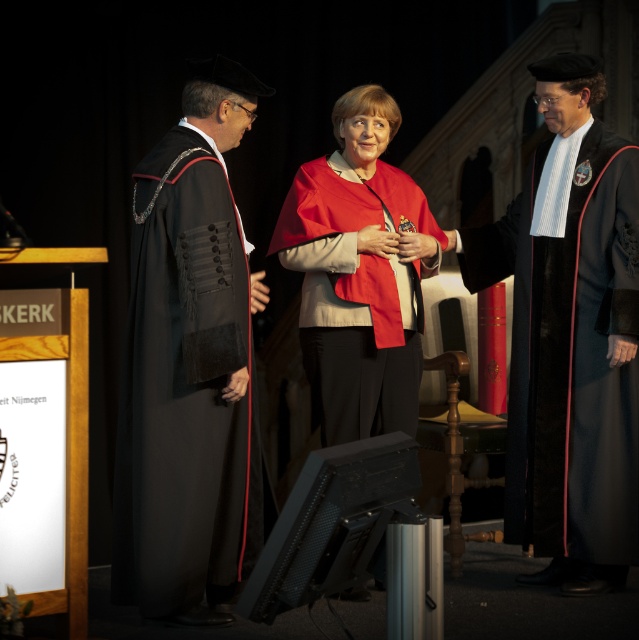
Between black velvet gown at right and matte red cape at center, which one has more height?

With more height is black velvet gown at right.

Is black velvet gown at right wider than matte red cape at center?

No, black velvet gown at right is not wider than matte red cape at center.

Locate an element on the screen. Image resolution: width=639 pixels, height=640 pixels. black velvet gown at right is located at coordinates coord(571,356).

Between black velvet gown at left and matte red cape at center, which one has more height?

black velvet gown at left

Is point (196, 452) positioned in front of point (399, 113)?

Yes, it is in front of point (399, 113).

The width and height of the screenshot is (639, 640). What are the coordinates of `black velvet gown at left` in the screenshot? It's located at pos(185,392).

Can you confirm if black velvet gown at left is positioned to the left of black velvet gown at right?

Indeed, black velvet gown at left is positioned on the left side of black velvet gown at right.

Is point (151, 448) closer to camera compared to point (619, 378)?

That is True.

Does point (266, 490) lie in front of point (539, 410)?

No, (266, 490) is further to viewer.

Find the location of a particular element. black velvet gown at left is located at coordinates (185, 392).